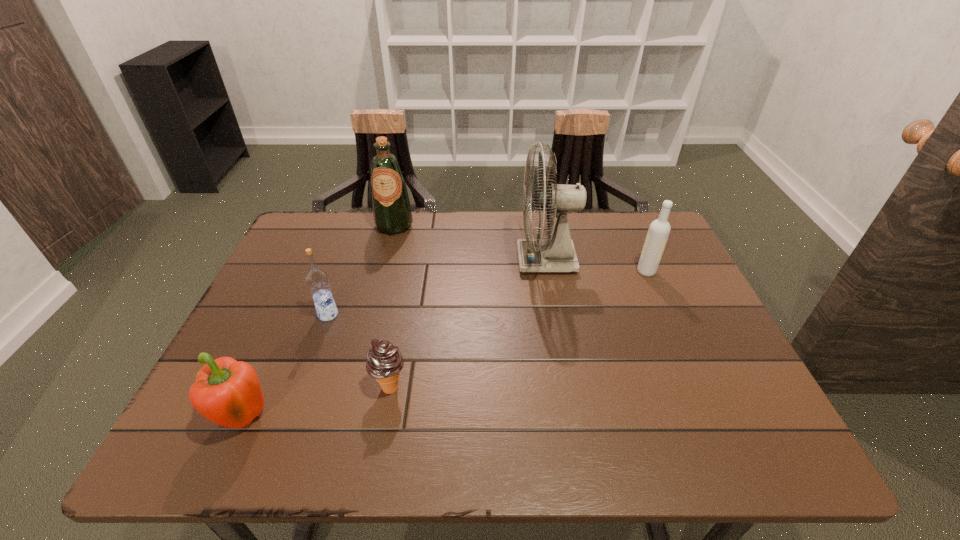
Locate an element on the screen. The height and width of the screenshot is (540, 960). empty space that is in between the second object from left to right and the leftmost object is located at coordinates (287, 367).

You are a GUI agent. You are given a task and a screenshot of the screen. Output one action in this format:
    pyautogui.click(x=<x>, y=<y>)
    Task: Click on the vacant space in between the shortest object and the right vodka
    This screenshot has width=960, height=540.
    Given the screenshot: What is the action you would take?
    pyautogui.click(x=518, y=329)

Image resolution: width=960 pixels, height=540 pixels. In order to click on empty space between the leftmost object and the right vodka in this screenshot , I will do `click(446, 346)`.

You are a GUI agent. You are given a task and a screenshot of the screen. Output one action in this format:
    pyautogui.click(x=<x>, y=<y>)
    Task: Click on the vacant space in between the tallest object and the left vodka
    
    Given the screenshot: What is the action you would take?
    pyautogui.click(x=438, y=287)

Locate an element on the screen. The height and width of the screenshot is (540, 960). free space that is in between the pepper and the right vodka is located at coordinates (446, 346).

Identify the location of free spot between the fan and the shortest object. (468, 323).

The height and width of the screenshot is (540, 960). What are the coordinates of `free point between the pepper and the left vodka` in the screenshot? It's located at (287, 367).

At what (x,y) coordinates should I click in order to perform the action: click on vacant area that lies between the olive oil and the leftmost object. Please return your answer as a coordinate pair (x, y). This screenshot has width=960, height=540. Looking at the image, I should click on (320, 322).

At what (x,y) coordinates should I click in order to perform the action: click on object that stands as the third closest to the leftmost object. Please return your answer as a coordinate pair (x, y). The height and width of the screenshot is (540, 960). Looking at the image, I should click on (392, 215).

Identify which object is the closest to the left vodka. Please provide its 2D coordinates. Your answer should be formatted as a tuple, i.e. [(x, y)], where the tuple contains the x and y coordinates of a point satisfying the conditions above.

[(384, 362)]